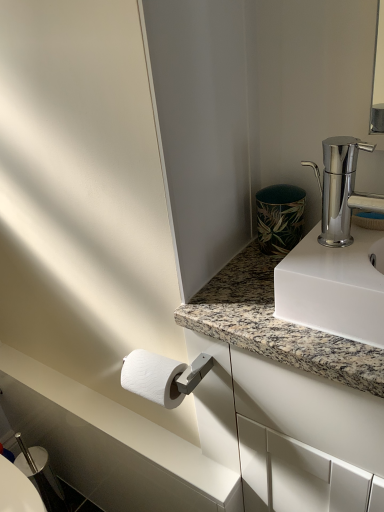
Question: Could you tell me if white marble countertop at lower left is facing silver metallic bidet at lower left?

Choices:
 (A) yes
 (B) no

Answer: (B)

Question: From the image's perspective, does white marble countertop at lower left appear lower than silver metallic bidet at lower left?

Choices:
 (A) no
 (B) yes

Answer: (A)

Question: From a real-world perspective, is white marble countertop at lower left located beneath silver metallic bidet at lower left?

Choices:
 (A) no
 (B) yes

Answer: (A)

Question: Considering the relative sizes of white marble countertop at lower left and silver metallic bidet at lower left in the image provided, is white marble countertop at lower left smaller than silver metallic bidet at lower left?

Choices:
 (A) no
 (B) yes

Answer: (B)

Question: Is white marble countertop at lower left positioned beyond the bounds of silver metallic bidet at lower left?

Choices:
 (A) yes
 (B) no

Answer: (A)

Question: Is white marble countertop at lower left further to camera compared to silver metallic bidet at lower left?

Choices:
 (A) yes
 (B) no

Answer: (B)

Question: Does green leaf-patterned ceramic at upper right have a larger size compared to polished chrome faucet at upper right?

Choices:
 (A) yes
 (B) no

Answer: (B)

Question: From a real-world perspective, is green leaf-patterned ceramic at upper right on top of polished chrome faucet at upper right?

Choices:
 (A) no
 (B) yes

Answer: (A)

Question: Is green leaf-patterned ceramic at upper right taller than polished chrome faucet at upper right?

Choices:
 (A) no
 (B) yes

Answer: (A)

Question: Is green leaf-patterned ceramic at upper right closer to the viewer compared to polished chrome faucet at upper right?

Choices:
 (A) no
 (B) yes

Answer: (A)

Question: Considering the relative sizes of green leaf-patterned ceramic at upper right and polished chrome faucet at upper right in the image provided, is green leaf-patterned ceramic at upper right thinner than polished chrome faucet at upper right?

Choices:
 (A) no
 (B) yes

Answer: (A)

Question: Can you confirm if green leaf-patterned ceramic at upper right is wider than polished chrome faucet at upper right?

Choices:
 (A) no
 (B) yes

Answer: (B)

Question: Is polished chrome faucet at upper right to the left of green leaf-patterned ceramic at upper right from the viewer's perspective?

Choices:
 (A) no
 (B) yes

Answer: (A)